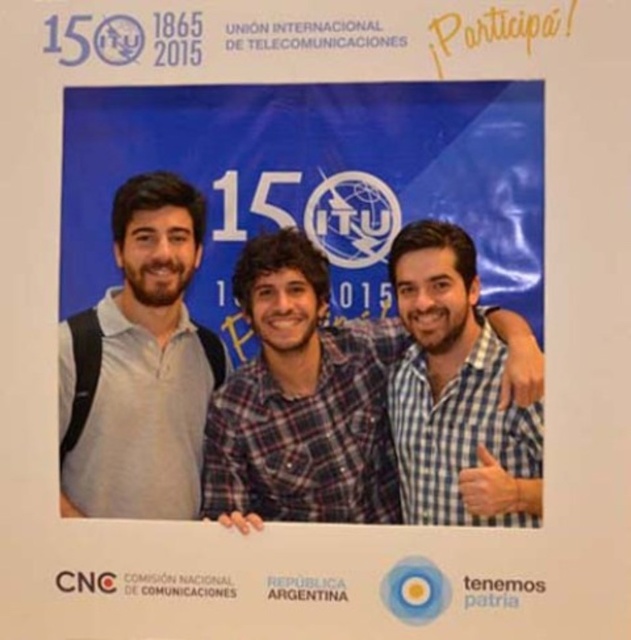
You are taking a photo of the three people standing in front of the promotional backdrop. You want to ensure that the person at point (x=156, y=451) and the person at point (x=495, y=374) are both in focus. Which of these two points is closer to the camera?

Point (x=156, y=451) is closer to the camera than point (x=495, y=374) because the description states that point (x=156, y=451) is further to the camera than point (x=495, y=374). Wait, there might be a confusion here. Let me check again. The description says Point (x=156, y=451) is further to the camera than point (x=495, y=374). That means point 0.705 is further away from the camera, so point 0.586 is closer. Therefore, the correct answer is point (x=495, y=374) is closer to the camera.

You are a photographer trying to arrange two shirts for a photo shoot. You have a plaid shirt at center and a checkered fabric shirt at center. According to the scene, which shirt should be placed to the left when arranging them side by side?

The plaid shirt at center should be placed to the left of the checkered fabric shirt at center because the plaid shirt at center is positioned on the left side of checkered fabric shirt at center in the scene.